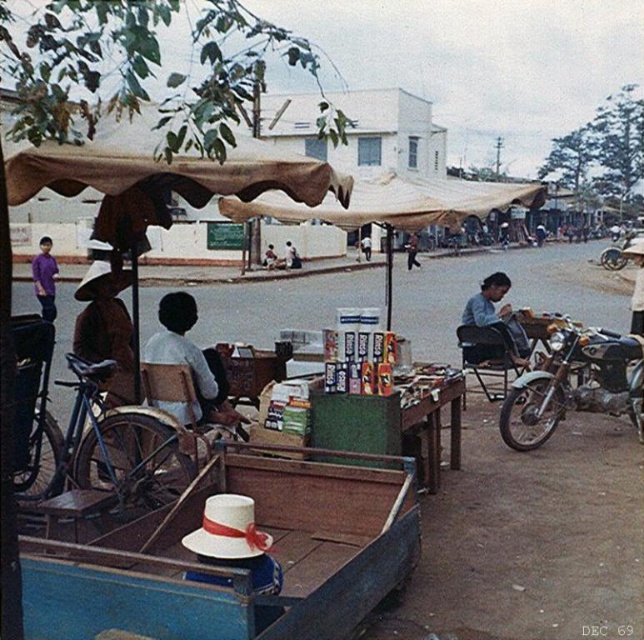
The width and height of the screenshot is (644, 640). I want to click on white matte hat at lower left, so click(234, 570).

Is the position of white matte hat at lower left less distant than that of blue denim shirt at center?

Yes, white matte hat at lower left is in front of blue denim shirt at center.

This screenshot has height=640, width=644. What are the coordinates of `white matte hat at lower left` in the screenshot? It's located at (234, 570).

At what (x,y) coordinates should I click in order to perform the action: click on white matte hat at lower left. Please return your answer as a coordinate pair (x, y). The image size is (644, 640). Looking at the image, I should click on (234, 570).

Who is lower down, white matte hat at lower left or purple cotton shirt at left?

Positioned lower is white matte hat at lower left.

Does white matte hat at lower left have a greater width compared to purple cotton shirt at left?

Incorrect, white matte hat at lower left's width does not surpass purple cotton shirt at left's.

I want to click on white matte hat at lower left, so click(234, 570).

I want to click on white matte hat at lower left, so click(x=234, y=570).

Which is more to the left, white matte hat at lower left or blue matte bicycle at left?

blue matte bicycle at left is more to the left.

Measure the distance between white matte hat at lower left and camera.

The distance of white matte hat at lower left from camera is 8.79 feet.

This screenshot has height=640, width=644. In order to click on white matte hat at lower left in this screenshot , I will do `click(234, 570)`.